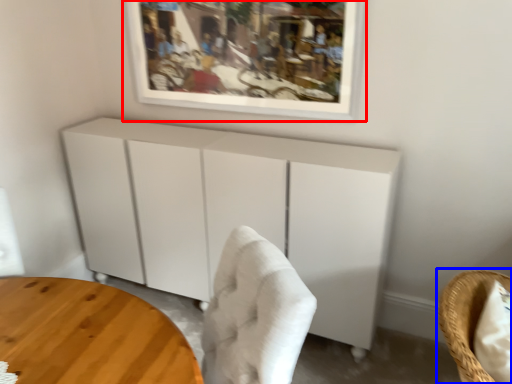
Question: Which object appears closest to the camera in this image, picture frame (highlighted by a red box) or chair (highlighted by a blue box)?

Choices:
 (A) picture frame
 (B) chair

Answer: (B)